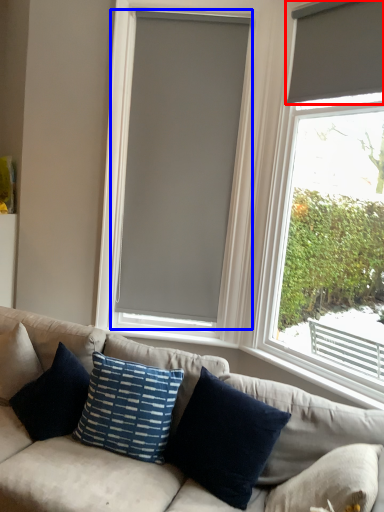
Question: Which of the following is the closest to the observer, window blind (highlighted by a red box) or window blind (highlighted by a blue box)?

Choices:
 (A) window blind
 (B) window blind

Answer: (A)